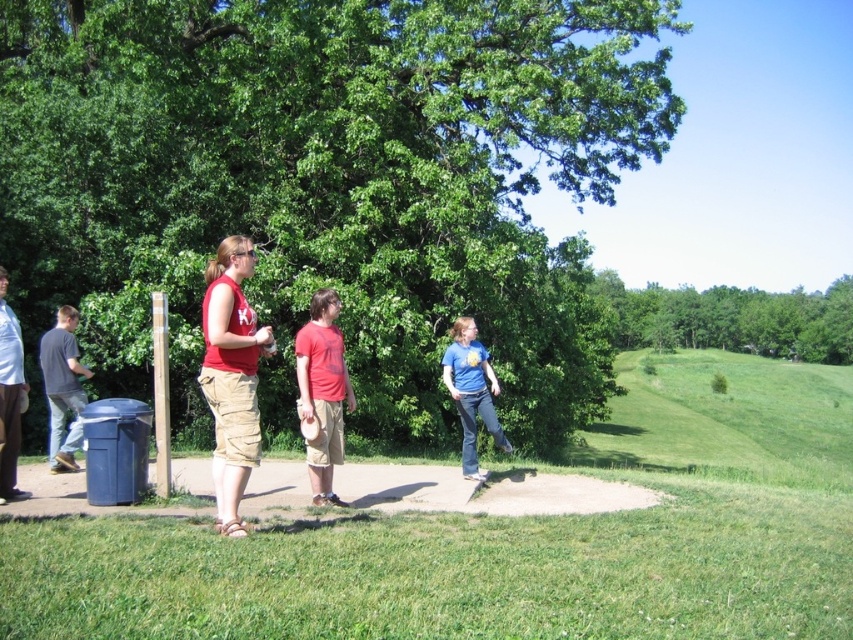
Who is positioned more to the left, matte red tank top at center or matte gray shirt at left?

Positioned to the left is matte gray shirt at left.

From the picture: How distant is matte red tank top at center from matte gray shirt at left?

The distance of matte red tank top at center from matte gray shirt at left is 6.98 feet.

Who is more distant from viewer, (227, 362) or (3, 269)?

The point (3, 269) is more distant.

Identify the location of matte red tank top at center. The height and width of the screenshot is (640, 853). (231, 376).

Does green leafy tree at upper center lie behind dark gray jeans at left?

That is True.

This screenshot has height=640, width=853. What do you see at coordinates (732, 317) in the screenshot?
I see `green leafy tree at upper center` at bounding box center [732, 317].

Is point (737, 340) positioned after point (59, 365)?

Yes, it is behind point (59, 365).

At what (x,y) coordinates should I click in order to perform the action: click on green leafy tree at upper center. Please return your answer as a coordinate pair (x, y). The image size is (853, 640). Looking at the image, I should click on (732, 317).

Who is positioned more to the right, dark gray jeans at left or matte gray shirt at left?

From the viewer's perspective, matte gray shirt at left appears more on the right side.

Is dark gray jeans at left wider than matte gray shirt at left?

Indeed, dark gray jeans at left has a greater width compared to matte gray shirt at left.

Which is in front, point (73, 388) or point (0, 477)?

Positioned in front is point (0, 477).

What are the coordinates of `dark gray jeans at left` in the screenshot? It's located at (62, 387).